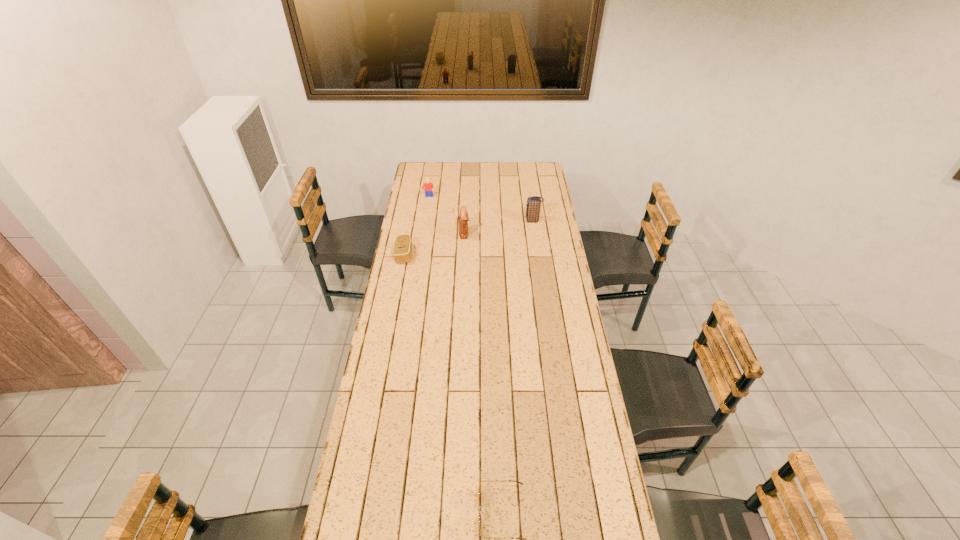
The height and width of the screenshot is (540, 960). I want to click on vacant space located 0.070m on the open side of the second nearest clutch bag, so click(484, 233).

Locate an element on the screen. This screenshot has height=540, width=960. blank area located 0.080m on the front-facing side of the farthest object is located at coordinates (427, 207).

Where is `vacant space located 0.240m on the zipper side of the leftmost clutch bag`? This screenshot has width=960, height=540. vacant space located 0.240m on the zipper side of the leftmost clutch bag is located at coordinates (463, 254).

Locate an element on the screen. The image size is (960, 540). Lego that is at the left edge is located at coordinates (429, 188).

I want to click on clutch bag located in the left edge section of the desktop, so click(x=402, y=250).

This screenshot has height=540, width=960. Find the location of `object that is at the right edge`. object that is at the right edge is located at coordinates (533, 203).

In the image, there is a desktop. Identify the location of vacant space at the far edge. (491, 169).

The height and width of the screenshot is (540, 960). In the image, there is a desktop. In order to click on blank space at the left edge in this screenshot , I will do `click(383, 316)`.

In the image, there is a desktop. Where is `free space at the right edge`? This screenshot has height=540, width=960. free space at the right edge is located at coordinates [545, 332].

In the image, there is a desktop. Identify the location of vacant space at the far left corner. The image size is (960, 540). (424, 174).